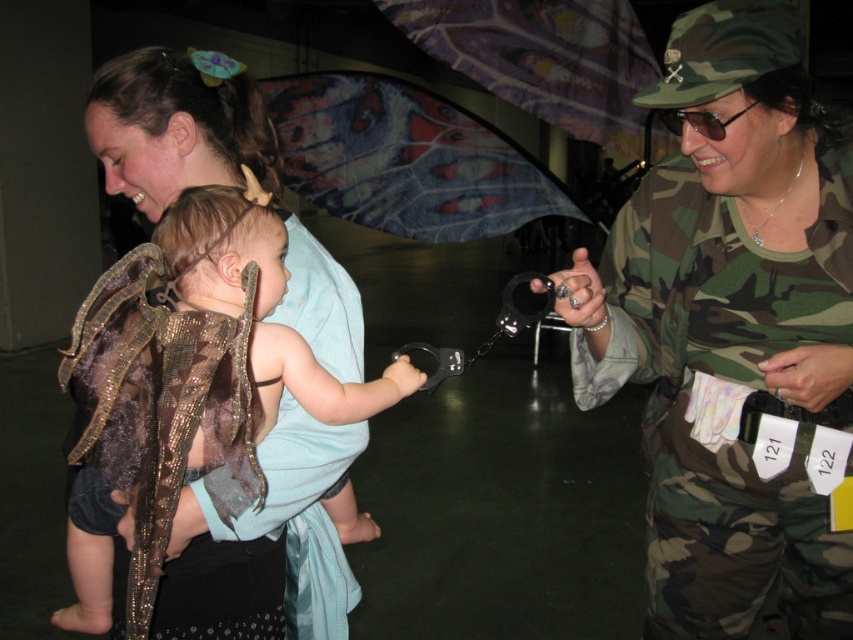
You are a photographer at the event and need to position the matte gold wings at upper left and the camouflage fabric baby carrier at center in your shot. Which object should you focus on first if you want to capture the taller object in the frame?

The matte gold wings at upper left should be focused on first since they are taller than the camouflage fabric baby carrier at center according to the description.

You are a photographer at the event and want to capture a photo where both the matte gold wings at upper left and the camouflage fabric baby carrier at center are visible. Based on their positions, which object should be placed closer to the left side of the frame to ensure both are in the shot?

The matte gold wings at upper left should be placed closer to the left side of the frame since it is already positioned to the left of the camouflage fabric baby carrier at center.

You are organizing a costume party and need to arrange two props. The camouflage uniform at center and the matte gold wings at upper left. Which prop requires more horizontal space to display properly?

The camouflage uniform at center requires more horizontal space because its width surpasses that of the matte gold wings at upper left.